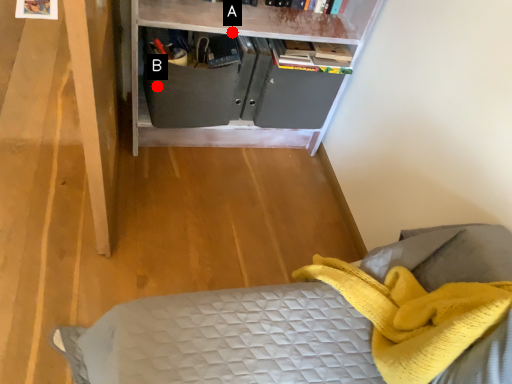
Question: Two points are circled on the image, labeled by A and B beside each circle. Among these points, which one is farthest from the camera?

Choices:
 (A) A is further
 (B) B is further

Answer: (B)